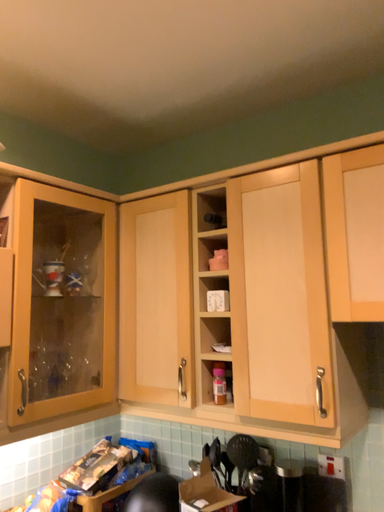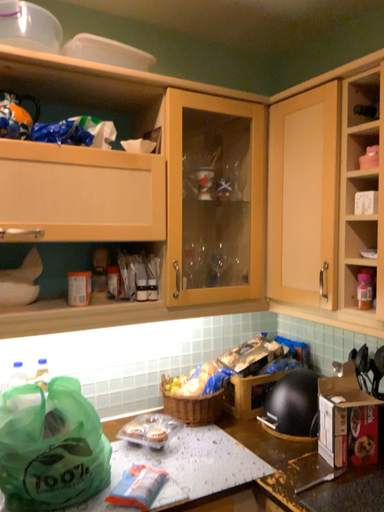
Question: How did the camera likely rotate when shooting the video?

Choices:
 (A) rotated upward
 (B) rotated downward

Answer: (B)